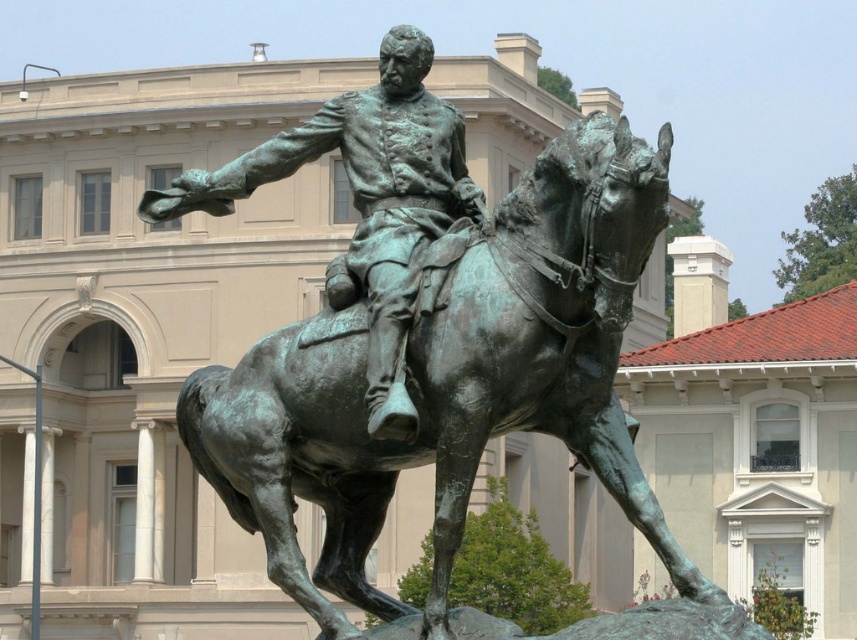
Is green patina horse at center above green patina statue at center?

Actually, green patina horse at center is below green patina statue at center.

Is green patina horse at center taller than green patina statue at center?

Yes.

The image size is (857, 640). What do you see at coordinates (451, 381) in the screenshot? I see `green patina horse at center` at bounding box center [451, 381].

The width and height of the screenshot is (857, 640). What are the coordinates of `green patina horse at center` in the screenshot? It's located at (451, 381).